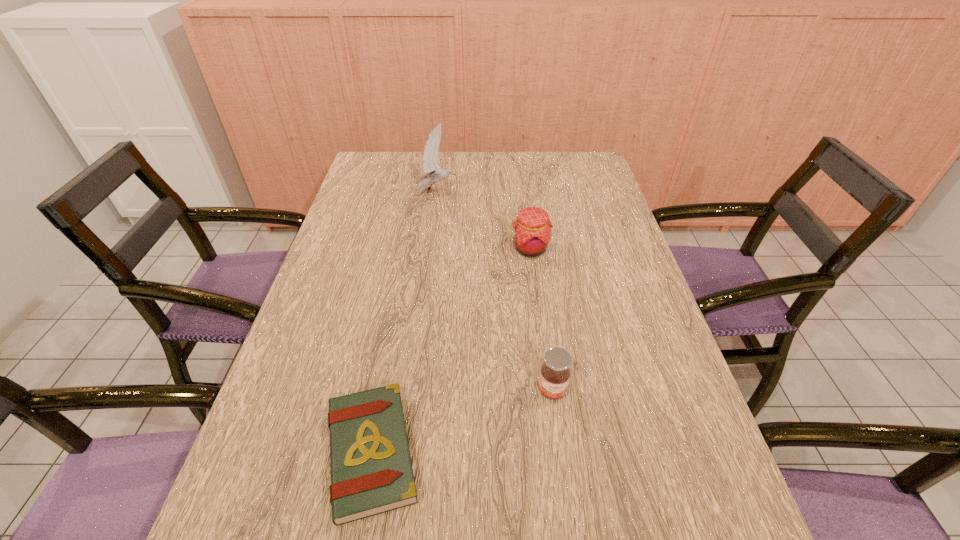
This screenshot has height=540, width=960. I want to click on vacant point that satisfies the following two spatial constraints: 1. on the back side of the shortest object; 2. on the left side of the third nearest object, so click(409, 249).

This screenshot has width=960, height=540. I want to click on free space that satisfies the following two spatial constraints: 1. on the back side of the second farthest object; 2. on the left side of the shortest object, so click(409, 249).